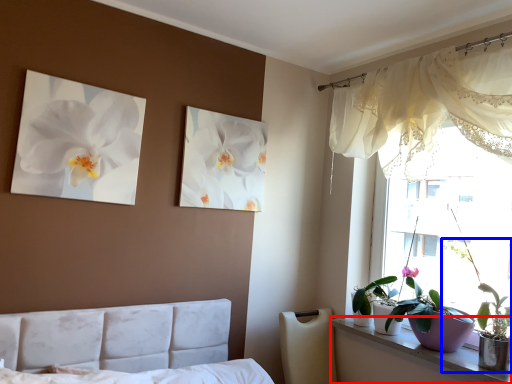
Question: Which of the following is the closest to the observer, window sill (highlighted by a red box) or houseplant (highlighted by a blue box)?

Choices:
 (A) window sill
 (B) houseplant

Answer: (A)